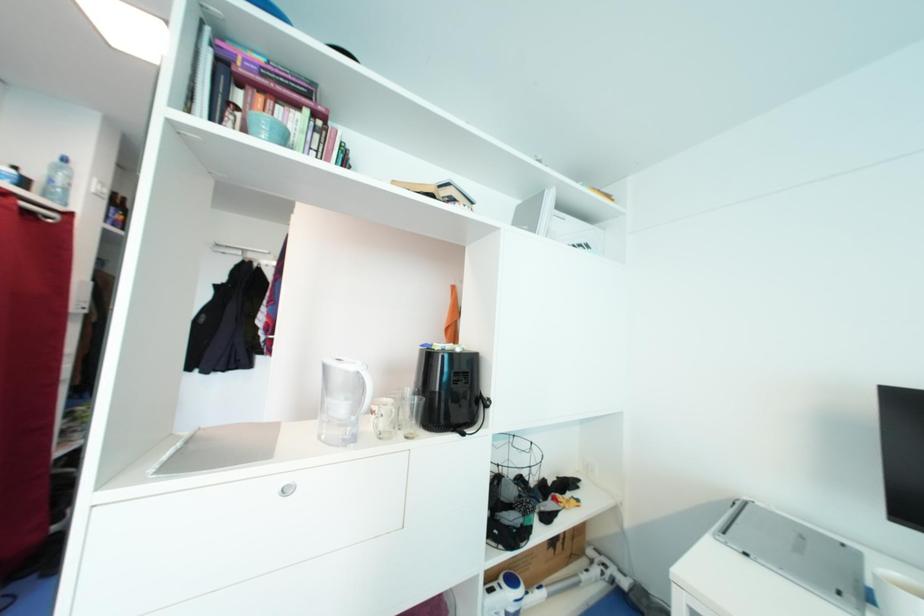
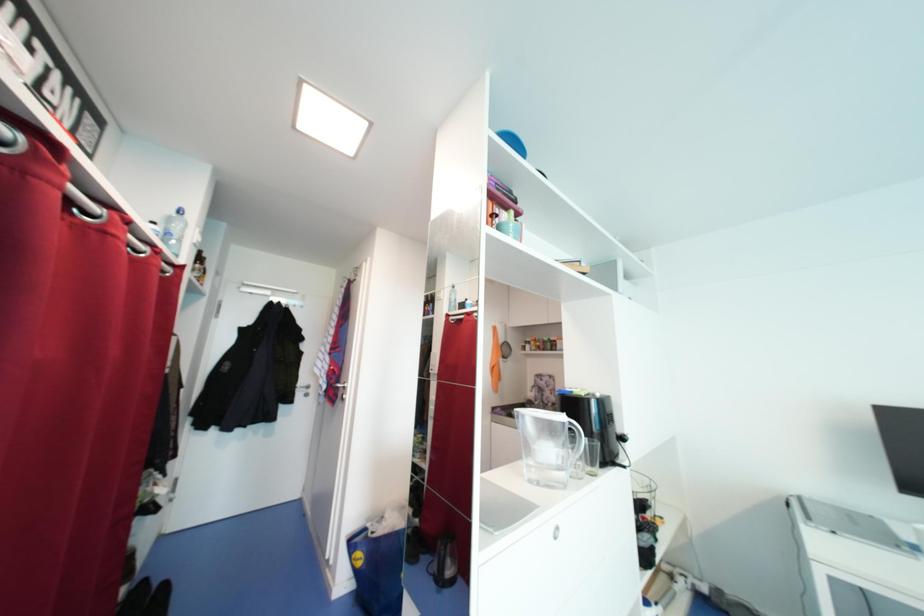
Question: Which direction would the cameraman need to move to produce the second image? Reply with the corresponding letter.

Choices:
 (A) Left
 (B) Right
 (C) Forward
 (D) Backward

Answer: (A)